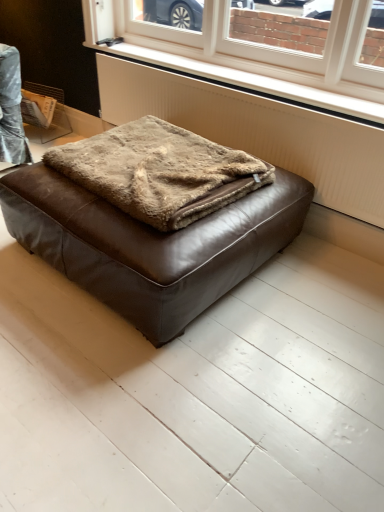
Question: From a real-world perspective, is white textured radiator at lower center above or below white textured radiator at center?

Choices:
 (A) above
 (B) below

Answer: (A)

Question: Is white textured radiator at lower center inside the boundaries of white textured radiator at center, or outside?

Choices:
 (A) inside
 (B) outside

Answer: (B)

Question: Estimate the real-world distances between objects in this image. Which object is closer to the white plastic window at upper center?

Choices:
 (A) white textured radiator at lower center
 (B) brown fuzzy blanket at center
 (C) brown leather ottoman at center
 (D) white textured radiator at center

Answer: (A)

Question: Which is nearer to the brown leather ottoman at center?

Choices:
 (A) white textured radiator at lower center
 (B) white textured radiator at center
 (C) white plastic window at upper center
 (D) brown fuzzy blanket at center

Answer: (D)